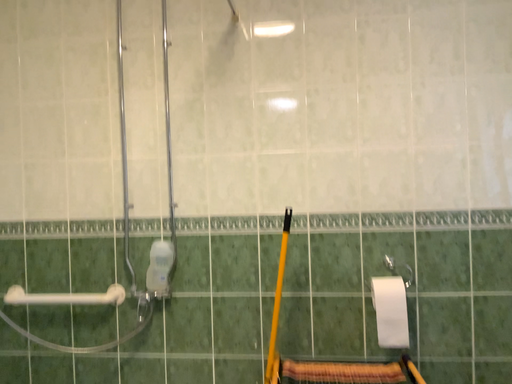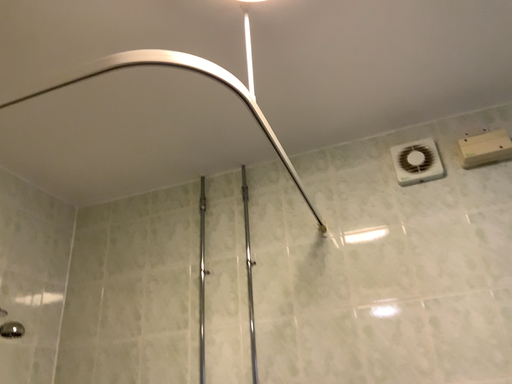
Question: How did the camera likely rotate when shooting the video?

Choices:
 (A) rotated left
 (B) rotated right

Answer: (A)